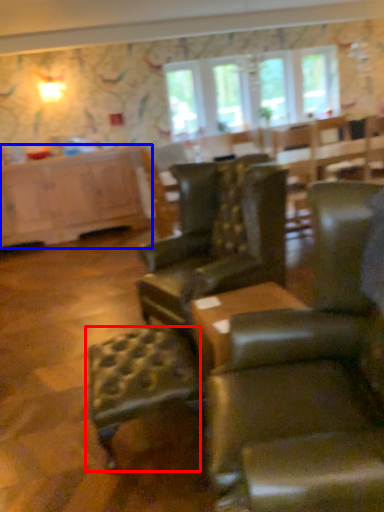
Question: Among these objects, which one is farthest to the camera, bar stool (highlighted by a red box) or cabinetry (highlighted by a blue box)?

Choices:
 (A) bar stool
 (B) cabinetry

Answer: (B)